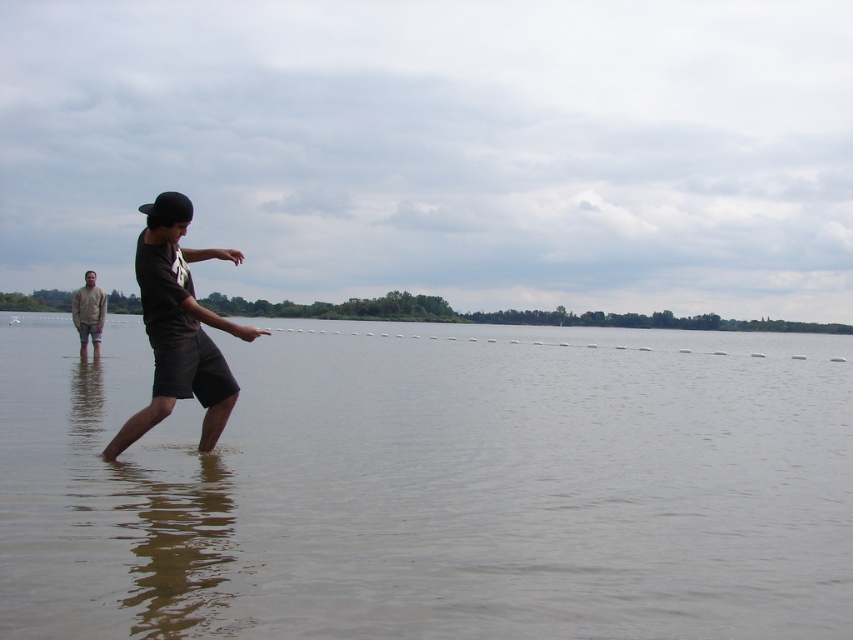
What do you see at coordinates (178, 326) in the screenshot?
I see `dark gray cotton shorts at center` at bounding box center [178, 326].

Consider the image. How far apart are dark gray cotton shorts at center and light brown cotton shirt at left?

dark gray cotton shorts at center and light brown cotton shirt at left are 11.43 meters apart from each other.

Where is `dark gray cotton shorts at center`? dark gray cotton shorts at center is located at coordinates (178, 326).

Can you confirm if clear water at center is positioned to the right of dark gray cotton shorts at center?

Correct, you'll find clear water at center to the right of dark gray cotton shorts at center.

Is point (538, 333) closer to viewer compared to point (138, 284)?

No, it is not.

At what (x,y) coordinates should I click in order to perform the action: click on clear water at center. Please return your answer as a coordinate pair (x, y). Looking at the image, I should click on (432, 486).

In the scene shown: Between clear water at center and light brown cotton shirt at left, which one is positioned lower?

clear water at center

Can you confirm if clear water at center is bigger than light brown cotton shirt at left?

Correct, clear water at center is larger in size than light brown cotton shirt at left.

This screenshot has height=640, width=853. What do you see at coordinates (432, 486) in the screenshot?
I see `clear water at center` at bounding box center [432, 486].

At what (x,y) coordinates should I click in order to perform the action: click on clear water at center. Please return your answer as a coordinate pair (x, y). Looking at the image, I should click on (432, 486).